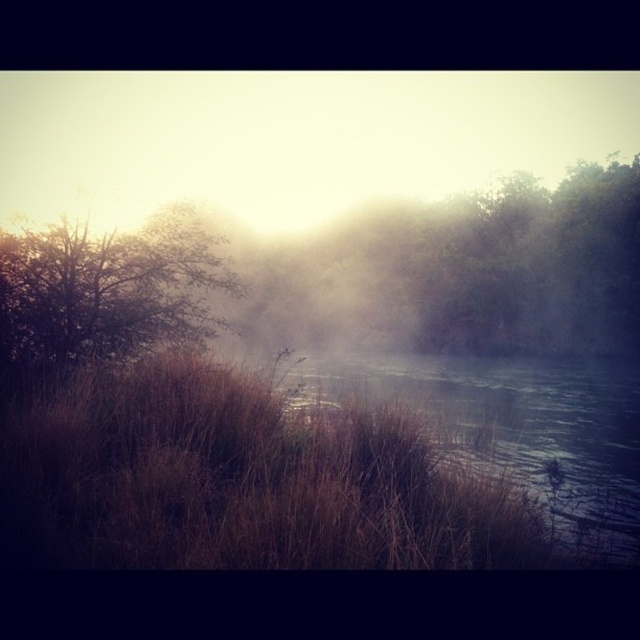
Where is `brown matte tree at center`? The width and height of the screenshot is (640, 640). brown matte tree at center is located at coordinates (476, 269).

Can you confirm if brown matte tree at center is positioned above brown textured tree at left?

Indeed, brown matte tree at center is positioned over brown textured tree at left.

Where is `brown matte tree at center`? brown matte tree at center is located at coordinates (476, 269).

Which is below, brown matte tree at center or brown grassy river at center?

Positioned lower is brown grassy river at center.

Consider the image. Who is more forward, [577,332] or [612,481]?

Point [612,481]

Between point (589, 349) and point (609, 449), which one is positioned behind?

Point (589, 349)

Where is `brown matte tree at center`? This screenshot has height=640, width=640. brown matte tree at center is located at coordinates (476, 269).

Does brown grassy river at center have a greater width compared to brown textured tree at left?

Indeed, brown grassy river at center has a greater width compared to brown textured tree at left.

Does point (307, 365) come farther from viewer compared to point (173, 333)?

Yes, point (307, 365) is behind point (173, 333).

You are a GUI agent. You are given a task and a screenshot of the screen. Output one action in this format:
    pyautogui.click(x=<x>, y=<y>)
    Task: Click on the brown grassy river at center
    
    Given the screenshot: What is the action you would take?
    pyautogui.click(x=515, y=428)